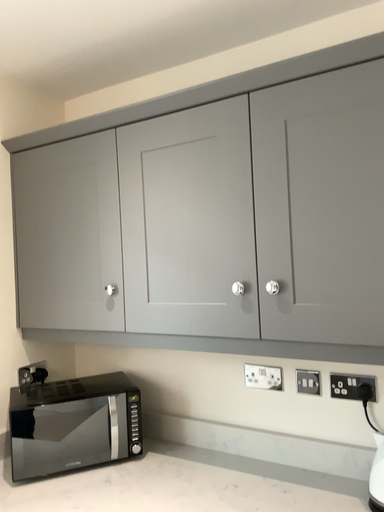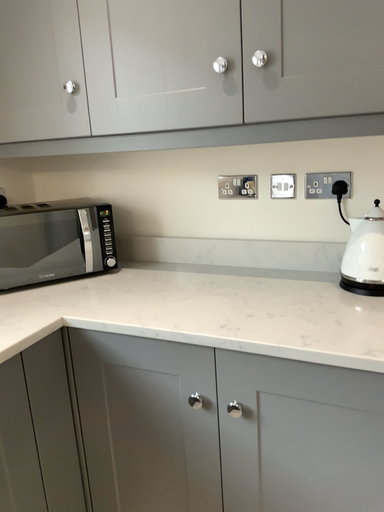
Question: Which way did the camera rotate in the video?

Choices:
 (A) rotated upward
 (B) rotated downward

Answer: (B)